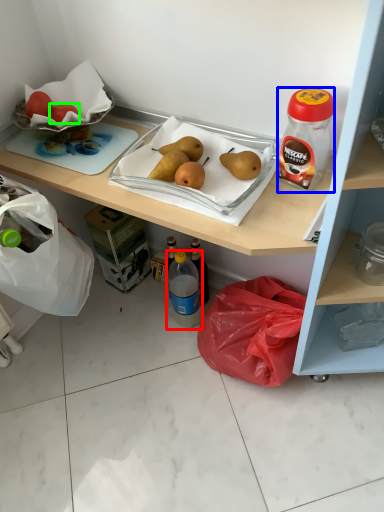
Question: Based on their relative distances, which object is nearer to bottle (highlighted by a red box)? Choose from bottle (highlighted by a blue box) and fruit (highlighted by a green box).

Choices:
 (A) bottle
 (B) fruit

Answer: (A)